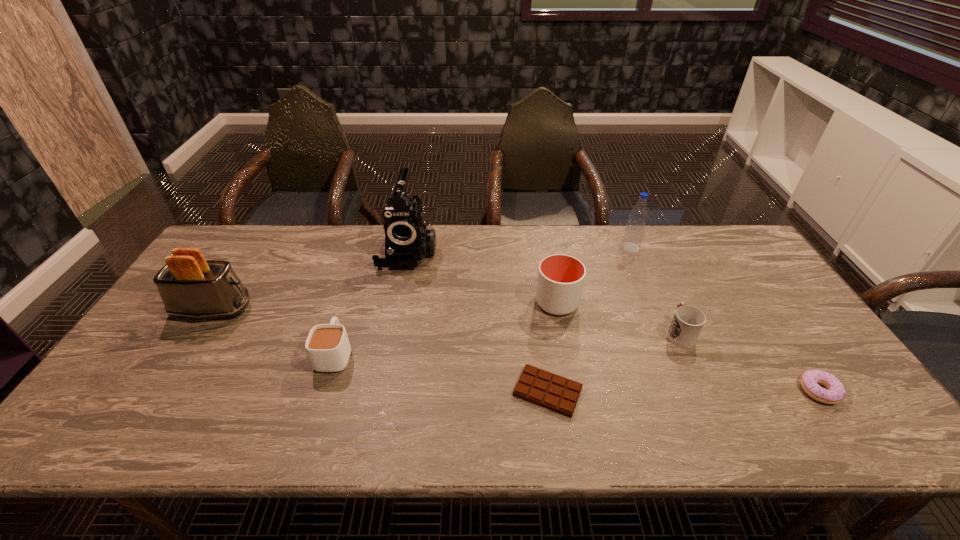
In the image, there is a desktop. Identify the location of blank space at the right edge. The width and height of the screenshot is (960, 540). (763, 299).

Locate an element on the screen. vacant space at the far left corner of the desktop is located at coordinates (244, 238).

This screenshot has width=960, height=540. In the image, there is a desktop. In order to click on blank space at the far right corner in this screenshot , I will do `click(733, 241)`.

Find the location of a particular element. This screenshot has width=960, height=540. free point between the rightmost cup and the shortest object is located at coordinates (613, 362).

Identify the location of empty space that is in between the leftmost object and the leftmost cup. (274, 331).

At what (x,y) coordinates should I click in order to perform the action: click on vacant space in between the rightmost object and the camcorder. Please return your answer as a coordinate pair (x, y). The image size is (960, 540). Looking at the image, I should click on (613, 321).

The height and width of the screenshot is (540, 960). In order to click on vacant area between the leftmost object and the leftmost cup in this screenshot , I will do `click(274, 331)`.

Image resolution: width=960 pixels, height=540 pixels. What are the coordinates of `vacant area that lies between the water bottle and the rightmost cup` in the screenshot? It's located at click(x=655, y=291).

In order to click on empty space that is in between the rightmost cup and the leftmost object in this screenshot , I will do `click(446, 321)`.

Identify the location of vacant point located between the tallest cup and the water bottle. (593, 275).